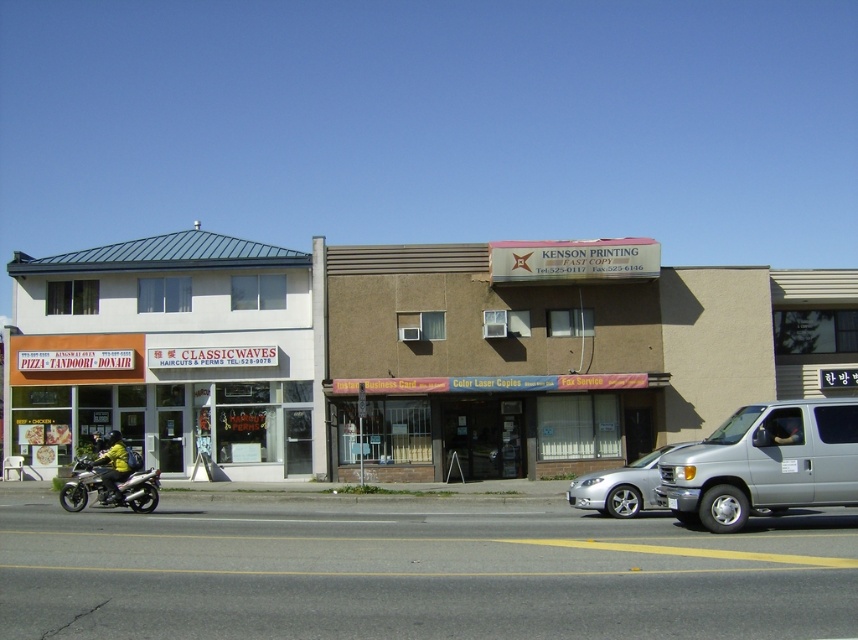
Question: Is silver metallic sedan at center positioned at the back of metallic silver motorcycle at lower left?

Choices:
 (A) no
 (B) yes

Answer: (A)

Question: Among these objects, which one is nearest to the camera?

Choices:
 (A) white matte building at left
 (B) metallic silver motorcycle at lower left

Answer: (B)

Question: Is silver metallic sedan at center below metallic silver motorcycle at lower left?

Choices:
 (A) no
 (B) yes

Answer: (B)

Question: Among these objects, which one is nearest to the camera?

Choices:
 (A) silver metallic van at right
 (B) yellow fabric jacket at lower left
 (C) silver metallic sedan at center
 (D) white matte building at left

Answer: (A)

Question: Is the position of silver metallic sedan at center less distant than that of metallic silver motorcycle at lower left?

Choices:
 (A) no
 (B) yes

Answer: (B)

Question: Which point is closer to the camera?

Choices:
 (A) (618, 497)
 (B) (125, 476)

Answer: (A)